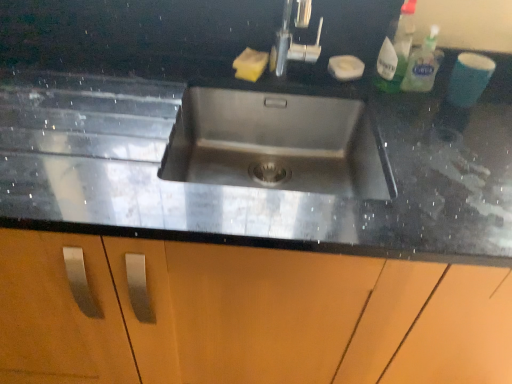
What are the coordinates of `free area in between translucent plastic spray bottle at upper right, acting as the 2th cleaning product starting from the right, and yellow sponge at upper center, acting as the second soap starting from the right` in the screenshot? It's located at (310, 74).